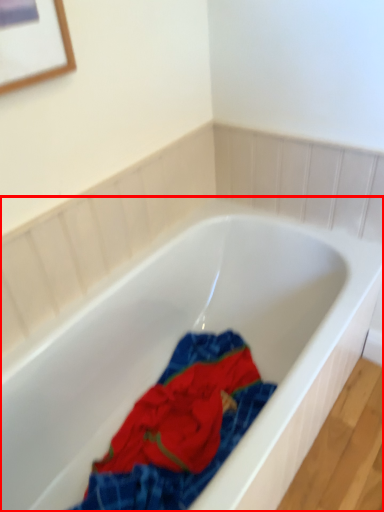
Question: From the image's perspective, where is bathtub (annotated by the red box) located in relation to material in the image?

Choices:
 (A) below
 (B) above

Answer: (B)